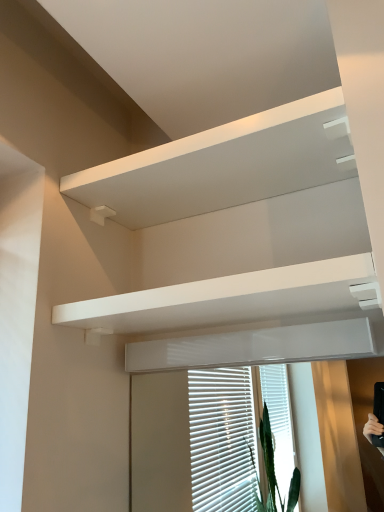
You are a GUI agent. You are given a task and a screenshot of the screen. Output one action in this format:
    pyautogui.click(x=<x>, y=<y>)
    Task: Click on the white matte shelf at upper center
    This screenshot has height=512, width=384.
    Given the screenshot: What is the action you would take?
    pyautogui.click(x=222, y=165)

Image resolution: width=384 pixels, height=512 pixels. Describe the element at coordinates (222, 165) in the screenshot. I see `white matte shelf at upper center` at that location.

Where is `white matte shelf at upper center`? white matte shelf at upper center is located at coordinates (222, 165).